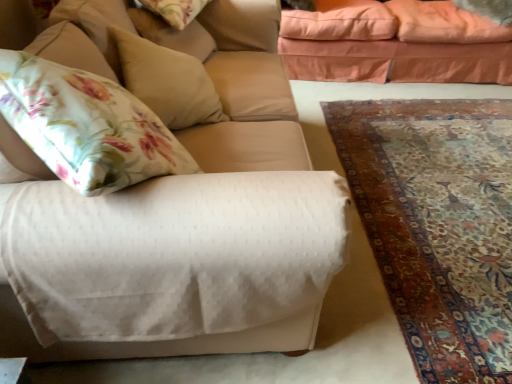
Find the location of a particular element. The height and width of the screenshot is (384, 512). free spot below carpet with intricate patterns at lower right (from a real-world perspective) is located at coordinates (442, 176).